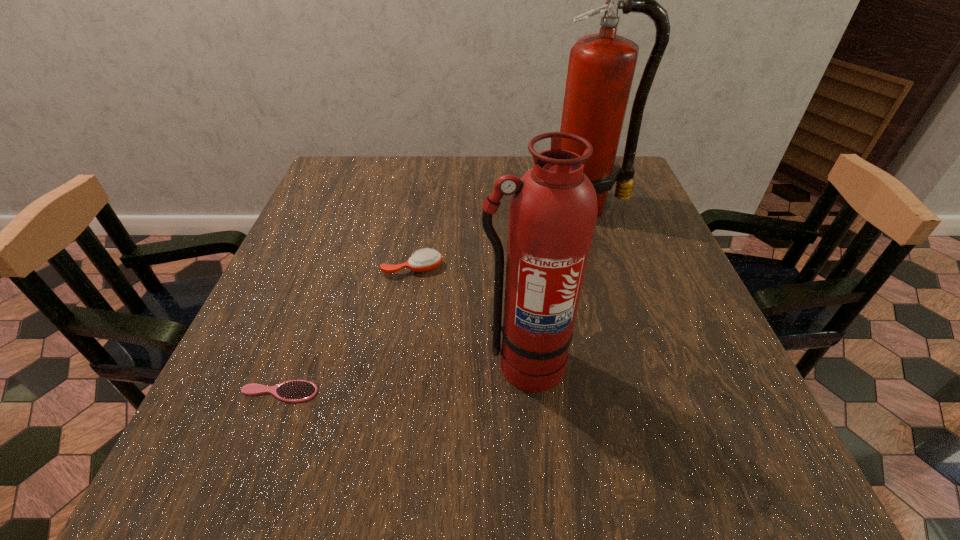
Locate an element on the screen. The height and width of the screenshot is (540, 960). object that can be found as the closest to the third tallest object is located at coordinates (553, 209).

Where is `the third closest object to the nearer hairbrush`? This screenshot has width=960, height=540. the third closest object to the nearer hairbrush is located at coordinates (601, 67).

Find the location of a particular element. Image resolution: width=960 pixels, height=540 pixels. vacant space that satisfies the following two spatial constraints: 1. on the back side of the farther hairbrush; 2. on the left side of the shorter hairbrush is located at coordinates [x=326, y=268].